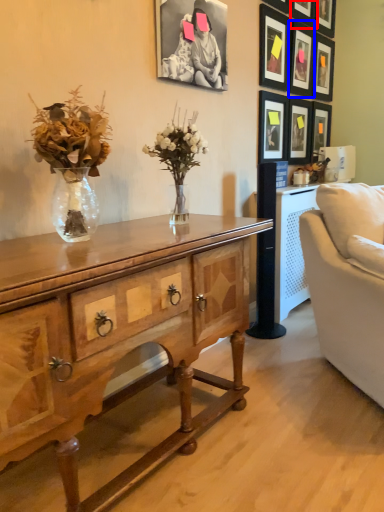
Question: Which object is further to the camera taking this photo, picture frame (highlighted by a red box) or picture frame (highlighted by a blue box)?

Choices:
 (A) picture frame
 (B) picture frame

Answer: (B)